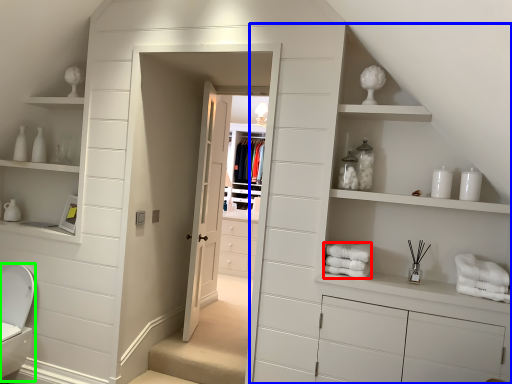
Question: Considering the real-world distances, which object is farthest from bath towel (highlighted by a red box)? dresser (highlighted by a blue box) or toilet bowl (highlighted by a green box)?

Choices:
 (A) dresser
 (B) toilet bowl

Answer: (B)